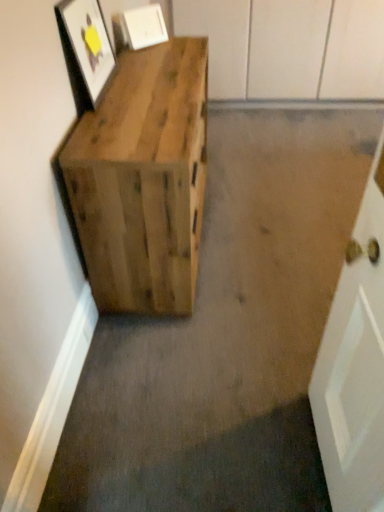
Question: Can you confirm if matte wooden picture frame at upper left, positioned as the first picture frame in front-to-back order, is bigger than natural wood crate at left?

Choices:
 (A) yes
 (B) no

Answer: (B)

Question: Is natural wood crate at left a part of matte wooden picture frame at upper left, positioned as the first picture frame in front-to-back order?

Choices:
 (A) yes
 (B) no

Answer: (B)

Question: Are matte wooden picture frame at upper left, which is the 2th picture frame in back-to-front order, and natural wood crate at left beside each other?

Choices:
 (A) no
 (B) yes

Answer: (A)

Question: Is matte wooden picture frame at upper left, positioned as the first picture frame in front-to-back order, positioned beyond the bounds of natural wood crate at left?

Choices:
 (A) no
 (B) yes

Answer: (B)

Question: Is matte wooden picture frame at upper left, which is the 2th picture frame in back-to-front order, thinner than natural wood crate at left?

Choices:
 (A) no
 (B) yes

Answer: (B)

Question: Can you confirm if matte wooden picture frame at upper left, positioned as the first picture frame in front-to-back order, is wider than natural wood crate at left?

Choices:
 (A) yes
 (B) no

Answer: (B)

Question: Is matte wooden picture frame at upper left, positioned as the first picture frame in front-to-back order, not near matte white picture frame at upper center, placed as the 2th picture frame when sorted from front to back?

Choices:
 (A) no
 (B) yes

Answer: (A)

Question: From a real-world perspective, is matte wooden picture frame at upper left, positioned as the first picture frame in front-to-back order, physically below matte white picture frame at upper center, placed as the 2th picture frame when sorted from front to back?

Choices:
 (A) no
 (B) yes

Answer: (A)

Question: Can you confirm if matte wooden picture frame at upper left, positioned as the first picture frame in front-to-back order, is bigger than matte white picture frame at upper center, placed as the 2th picture frame when sorted from front to back?

Choices:
 (A) yes
 (B) no

Answer: (A)

Question: Is matte wooden picture frame at upper left, positioned as the first picture frame in front-to-back order, to the right of matte white picture frame at upper center, the first picture frame viewed from the back, from the viewer's perspective?

Choices:
 (A) no
 (B) yes

Answer: (A)

Question: From a real-world perspective, is matte wooden picture frame at upper left, positioned as the first picture frame in front-to-back order, over matte white picture frame at upper center, the first picture frame viewed from the back?

Choices:
 (A) yes
 (B) no

Answer: (A)

Question: Is matte wooden picture frame at upper left, positioned as the first picture frame in front-to-back order, aimed at matte white picture frame at upper center, the first picture frame viewed from the back?

Choices:
 (A) yes
 (B) no

Answer: (B)

Question: Is matte white picture frame at upper center, the first picture frame viewed from the back, not close to matte wooden picture frame at upper left, positioned as the first picture frame in front-to-back order?

Choices:
 (A) no
 (B) yes

Answer: (A)